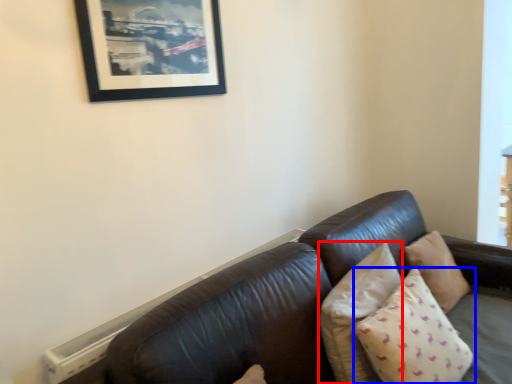
Question: Which point is closer to the camera, pillow (highlighted by a red box) or pillow (highlighted by a blue box)?

Choices:
 (A) pillow
 (B) pillow

Answer: (B)